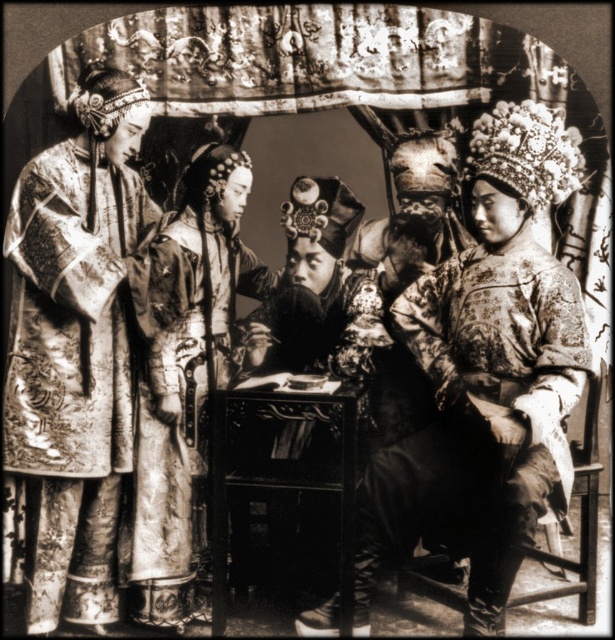
Who is lower down, silky brocade robe at left or floral-patterned silk robe at center?

Positioned lower is floral-patterned silk robe at center.

Can you confirm if silky brocade robe at left is taller than floral-patterned silk robe at center?

Correct, silky brocade robe at left is much taller as floral-patterned silk robe at center.

Between point (140, 205) and point (478, 305), which one is positioned behind?

The point (140, 205) is more distant.

At what (x,y) coordinates should I click in order to perform the action: click on silky brocade robe at left. Please return your answer as a coordinate pair (x, y). Looking at the image, I should click on (74, 349).

Is the position of silky brocade robe at left more distant than that of silky brocade robe at center?

No, silky brocade robe at left is closer to the viewer.

Is silky brocade robe at left shorter than silky brocade robe at center?

No, silky brocade robe at left is not shorter than silky brocade robe at center.

Is point (7, 349) farther from viewer compared to point (216, 168)?

No, (7, 349) is in front of (216, 168).

Identify the location of silky brocade robe at left. (74, 349).

Is floral-patterned silk robe at center positioned in front of silky brocade robe at center?

Yes.

Can you confirm if floral-patterned silk robe at center is thinner than silky brocade robe at center?

In fact, floral-patterned silk robe at center might be wider than silky brocade robe at center.

Between point (446, 280) and point (184, 276), which one is positioned in front?

Point (184, 276)

Image resolution: width=615 pixels, height=640 pixels. In order to click on floral-patterned silk robe at center in this screenshot , I will do `click(485, 410)`.